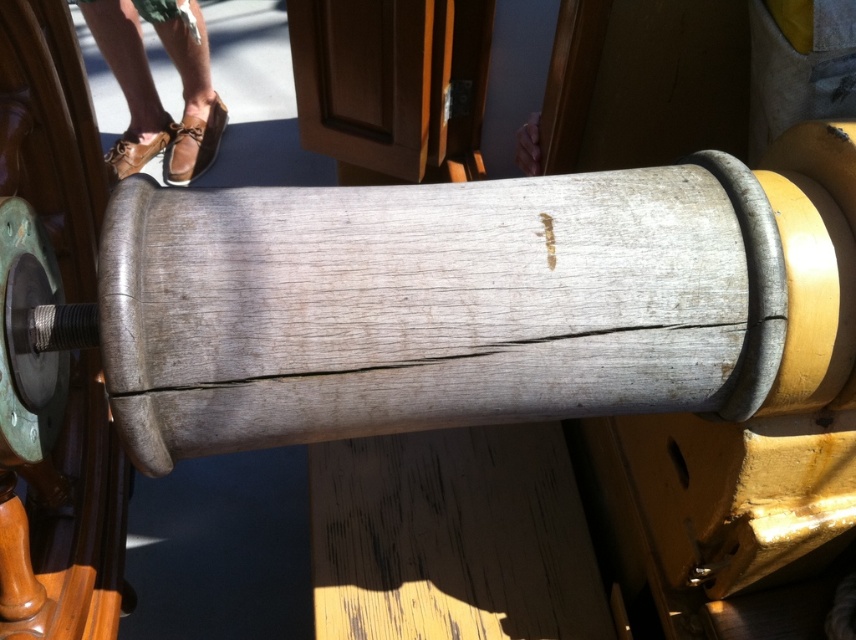
Is green patina metal at left below brown leather shoes at upper left?

Correct, green patina metal at left is located below brown leather shoes at upper left.

Consider the image. Is green patina metal at left shorter than brown leather shoes at upper left?

No.

What do you see at coordinates (51, 134) in the screenshot? I see `green patina metal at left` at bounding box center [51, 134].

The width and height of the screenshot is (856, 640). In order to click on green patina metal at left in this screenshot , I will do `click(51, 134)`.